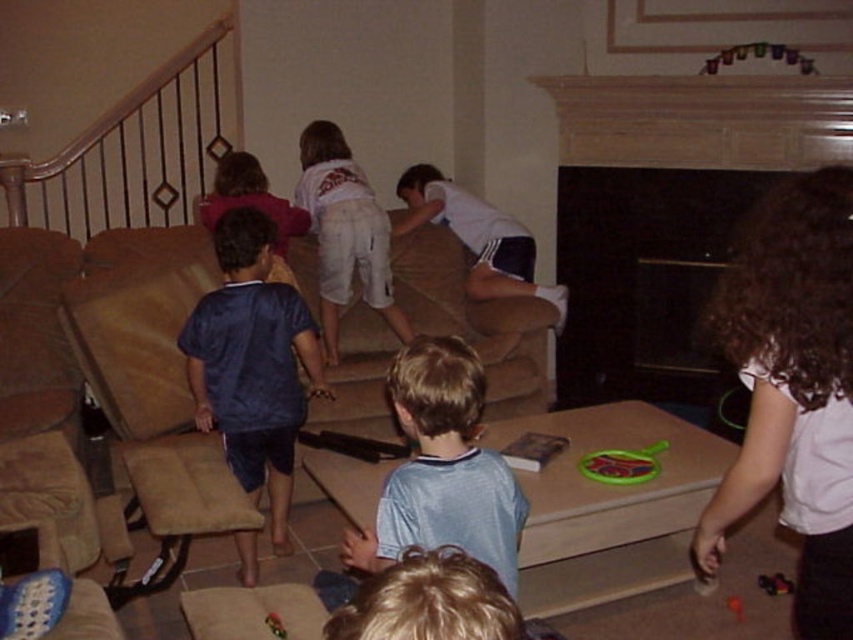
Question: Which object is positioned closest to the rubberized green frisbee at lower center?

Choices:
 (A) black matte fireplace at center
 (B) blue jersey at center
 (C) light blue jersey at center

Answer: (C)

Question: Can you confirm if light blue jersey at center is positioned above rubberized green frisbee at lower center?

Choices:
 (A) yes
 (B) no

Answer: (A)

Question: Which object is the farthest from the white cotton shirt at center?

Choices:
 (A) rubberized plastic toy at lower right
 (B) blue jersey at center
 (C) black matte fireplace at center
 (D) rubberized plastic toy at lower center

Answer: (D)

Question: Is black matte fireplace at center further to the viewer compared to rubberized green frisbee at lower center?

Choices:
 (A) no
 (B) yes

Answer: (B)

Question: Is black matte fireplace at center to the left of blue jersey at center from the viewer's perspective?

Choices:
 (A) yes
 (B) no

Answer: (B)

Question: Based on their relative distances, which object is farther from the rubberized plastic toy at lower right?

Choices:
 (A) white cotton shirt at center
 (B) black matte fireplace at center
 (C) light blue jersey at center
 (D) white cotton shorts at center

Answer: (D)